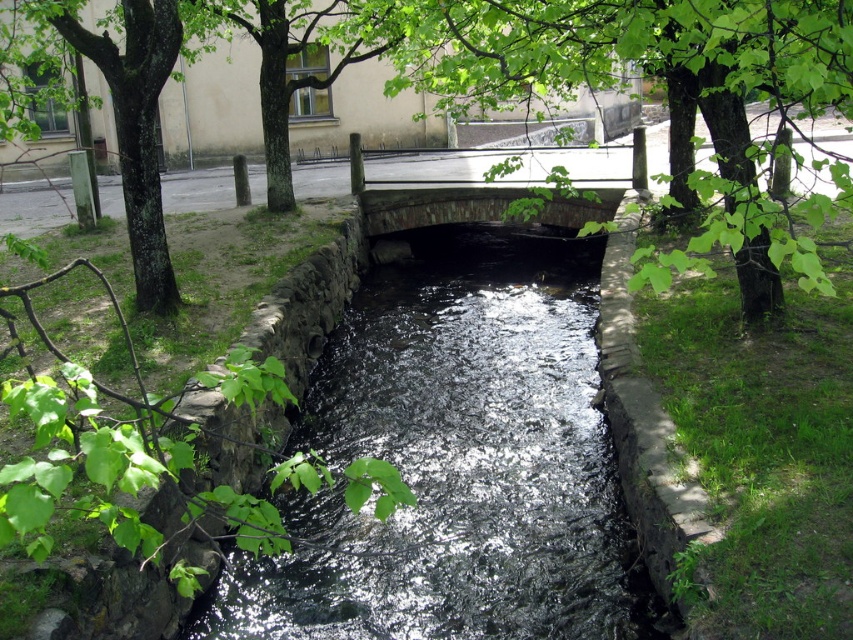
Question: Which point is closer to the camera taking this photo?

Choices:
 (A) (347, 344)
 (B) (779, 8)

Answer: (B)

Question: Does shiny dark water at center appear over stone bridge at center?

Choices:
 (A) no
 (B) yes

Answer: (A)

Question: Is green leafy tree at center above stone bridge at center?

Choices:
 (A) no
 (B) yes

Answer: (B)

Question: Among these objects, which one is farthest from the camera?

Choices:
 (A) stone bridge at center
 (B) green leafy tree at center

Answer: (A)

Question: Can you confirm if shiny dark water at center is thinner than stone bridge at center?

Choices:
 (A) yes
 (B) no

Answer: (B)

Question: Which point is farther to the camera?

Choices:
 (A) shiny dark water at center
 (B) stone bridge at center
 (C) green leafy tree at center

Answer: (B)